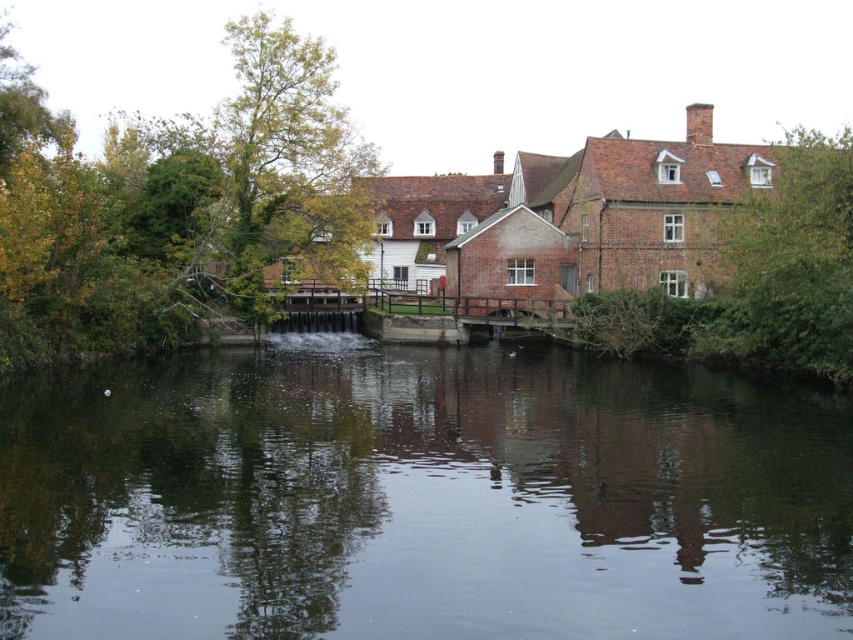
Question: Which of the following is the farthest from the observer?

Choices:
 (A) brown textured tree at right
 (B) green leafy tree at center

Answer: (B)

Question: Is green leafy tree at center bigger than brown textured tree at right?

Choices:
 (A) no
 (B) yes

Answer: (B)

Question: Based on their relative distances, which object is nearer to the brown textured tree at right?

Choices:
 (A) green leafy tree at center
 (B) dark reflective water at center

Answer: (B)

Question: Can you confirm if dark reflective water at center is positioned to the right of brown textured tree at right?

Choices:
 (A) no
 (B) yes

Answer: (A)

Question: Which point is farther to the camera?

Choices:
 (A) (280, 48)
 (B) (6, 506)

Answer: (A)

Question: Does dark reflective water at center have a smaller size compared to brown textured tree at right?

Choices:
 (A) yes
 (B) no

Answer: (A)